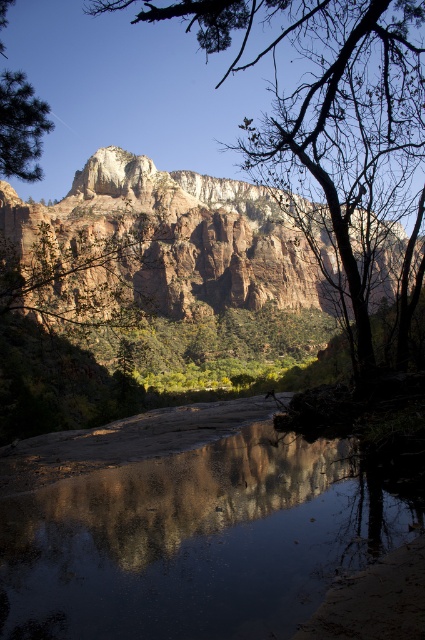
You are an artist planning to paint this landscape. You want to ensure the smooth reflective water at center and the smooth bark tree at upper center are proportionally accurate. Which object should be drawn smaller in your painting?

The smooth reflective water at center should be drawn smaller because it is not as tall as the smooth bark tree at upper center.

You are standing at point (186,528) in the image. Based on the scene description, what would you observe around you?

You would observe smooth reflective water at center around you as you are standing at point (186,528).